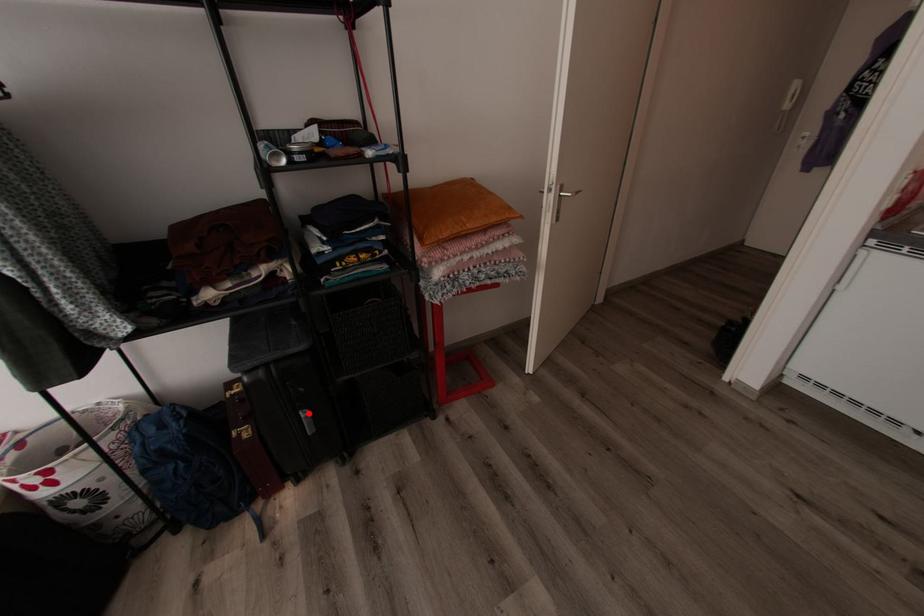
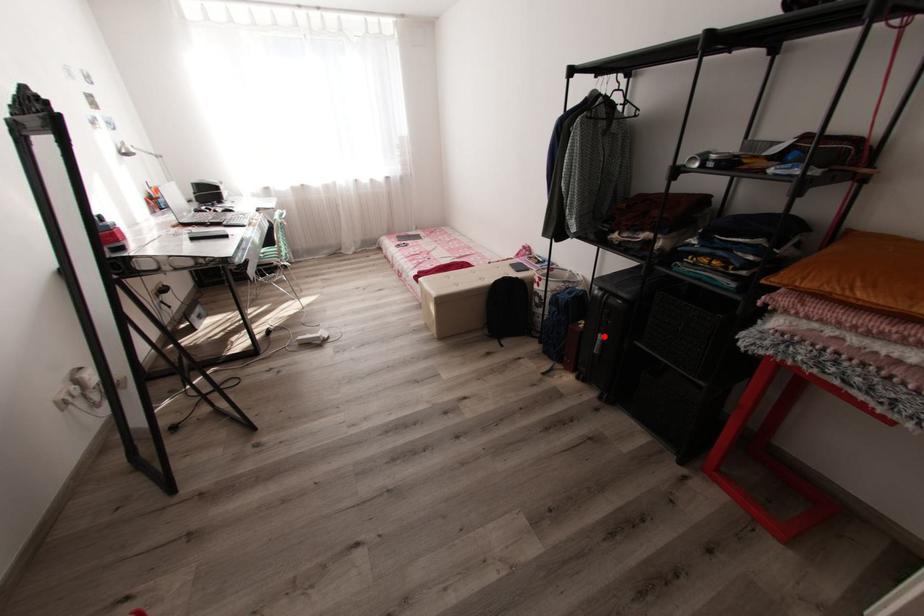
I am providing you with two images of the same scene from different viewpoints. A red point is marked on the first image and another point is marked on the second image. Is the marked point in image1 the same physical position as the marked point in image2?

Yes